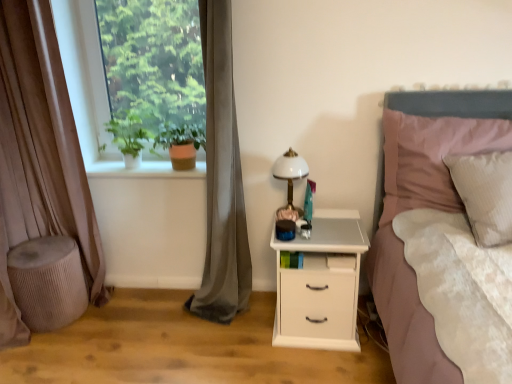
Identify the location of vacant space that is to the left of white matte nightstand at lower right. This screenshot has height=384, width=512. (245, 336).